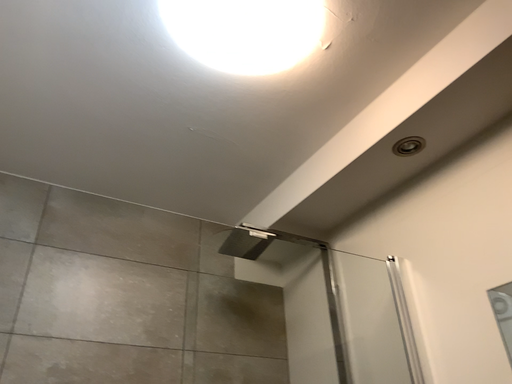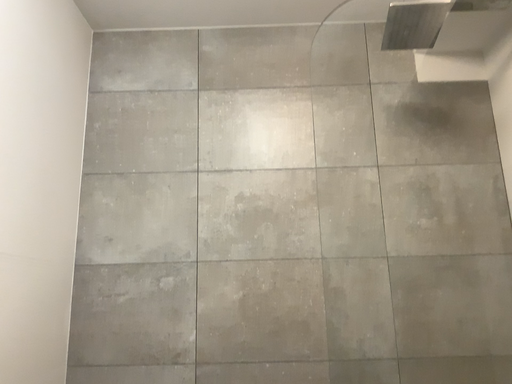
Question: Which way did the camera rotate in the video?

Choices:
 (A) rotated upward
 (B) rotated downward

Answer: (B)